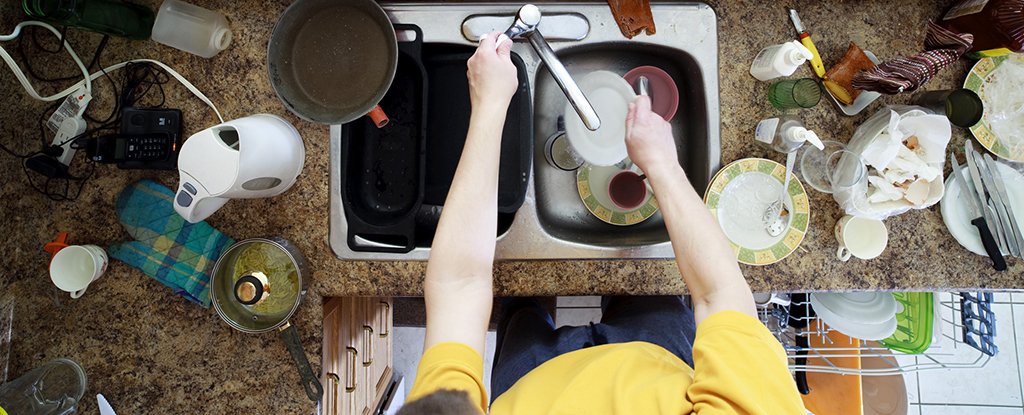
At what (x,y) coordinates should I click in order to perform the action: click on cabinet drawers. Please return your answer as a coordinate pair (x, y). Looking at the image, I should click on (384, 353), (359, 385), (340, 404).